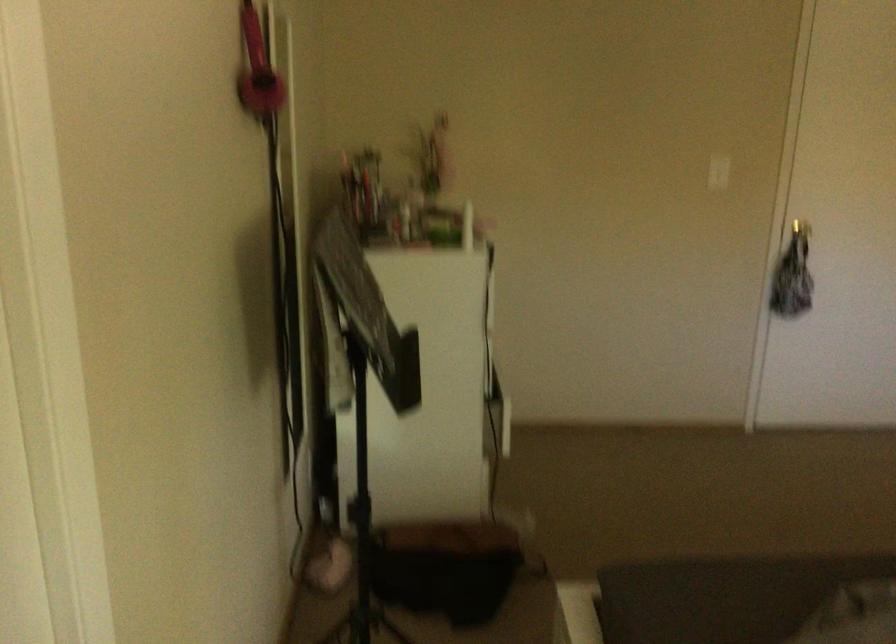
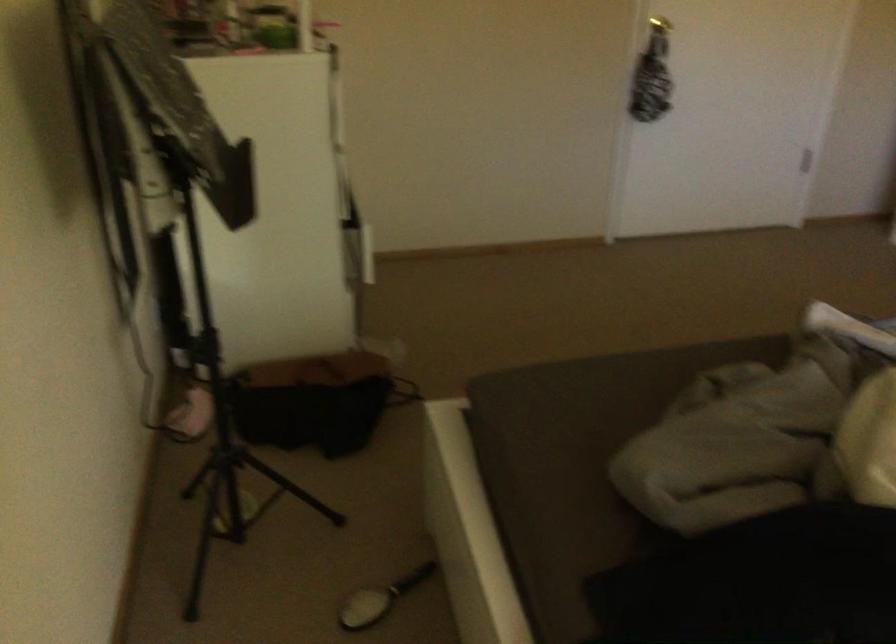
What movement of the cameraman would produce the second image?

The movement direction of the cameraman is right, forward.